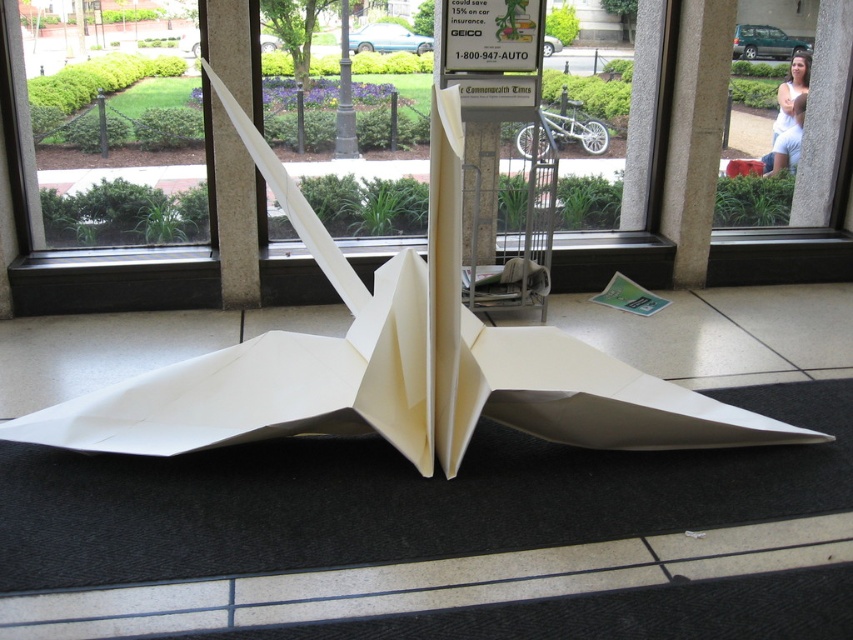
You are an interior designer assessing the space. You need to place a new decorative item between the white stone pillar at upper right and the black metal pole at center. Which object should the item be placed closer to if you want it to be near the thinner structure?

The white stone pillar at upper right is thinner than the black metal pole at center, so the decorative item should be placed closer to the white stone pillar at upper right to be near the thinner structure.

You are standing in the room with the white stone pillar at upper right and the white paper airplane at center. If you walk straight ahead, which object will you encounter first?

You will encounter the white stone pillar at upper right first because it is closer to you than the white paper airplane at center.